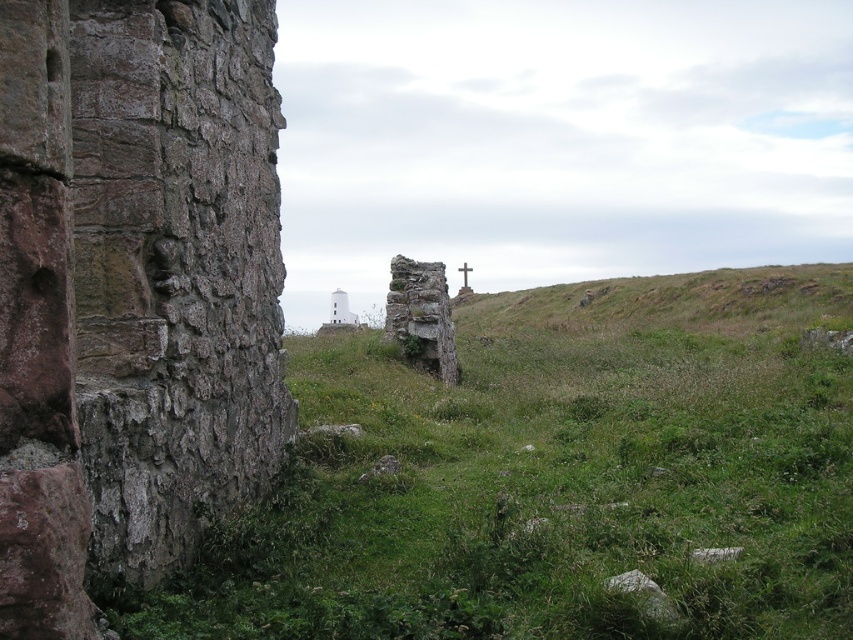
Question: Is the position of green grassy hillside at center more distant than that of white smooth tower at center?

Choices:
 (A) yes
 (B) no

Answer: (B)

Question: Among these points, which one is farthest from the camera?

Choices:
 (A) (334, 292)
 (B) (465, 269)

Answer: (B)

Question: Does rusty stone wall at left lie behind white wooden cross at center?

Choices:
 (A) no
 (B) yes

Answer: (A)

Question: Where is white smooth tower at center located in relation to white wooden cross at center in the image?

Choices:
 (A) below
 (B) above

Answer: (A)

Question: Which of the following is the closest to the observer?

Choices:
 (A) (33, 33)
 (B) (569, 300)

Answer: (A)

Question: Which object is closer to the camera taking this photo?

Choices:
 (A) white wooden cross at center
 (B) green grassy at center
 (C) white smooth tower at center

Answer: (B)